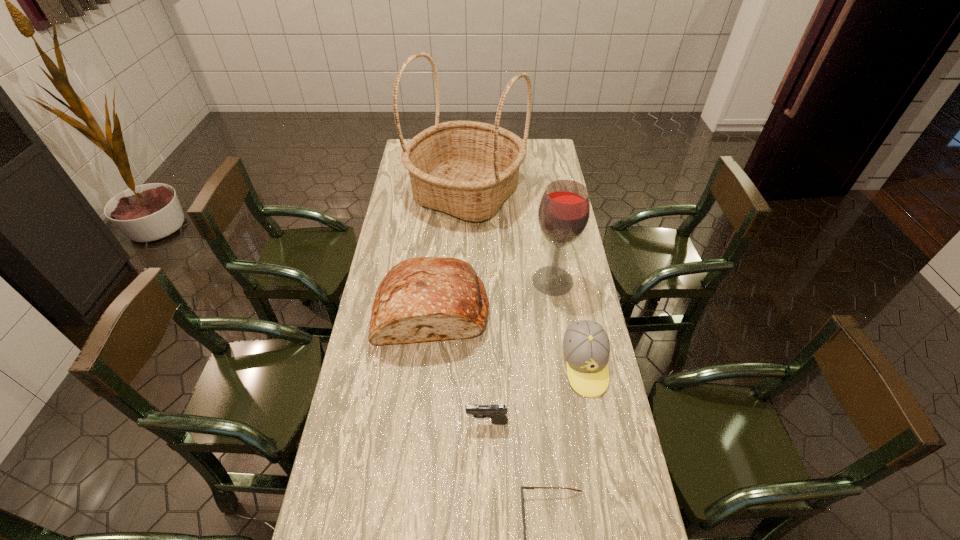
The height and width of the screenshot is (540, 960). I want to click on the tallest object, so [x=467, y=169].

Locate an element on the screen. The height and width of the screenshot is (540, 960). basket is located at coordinates (467, 169).

You are a GUI agent. You are given a task and a screenshot of the screen. Output one action in this format:
    pyautogui.click(x=<x>, y=<y>)
    Task: Click on the alcohol
    
    Given the screenshot: What is the action you would take?
    pyautogui.click(x=564, y=210)

Where is `bread`? This screenshot has height=540, width=960. bread is located at coordinates (421, 299).

I want to click on baseball cap, so click(x=586, y=347).

The height and width of the screenshot is (540, 960). I want to click on the fifth tallest object, so click(x=496, y=412).

The height and width of the screenshot is (540, 960). I want to click on the second nearest object, so coord(496,412).

You are a GUI agent. You are given a task and a screenshot of the screen. Output one action in this format:
    pyautogui.click(x=<x>, y=<y>)
    Task: Click on the vacant point located on the right of the farthest object
    This screenshot has width=960, height=540.
    Given the screenshot: What is the action you would take?
    pyautogui.click(x=542, y=194)

In order to click on vacant space situated 0.130m on the back of the alcohol in this screenshot , I will do `click(546, 244)`.

Image resolution: width=960 pixels, height=540 pixels. What are the coordinates of `vacant space located at the sliced front of the third tallest object` in the screenshot? It's located at (424, 392).